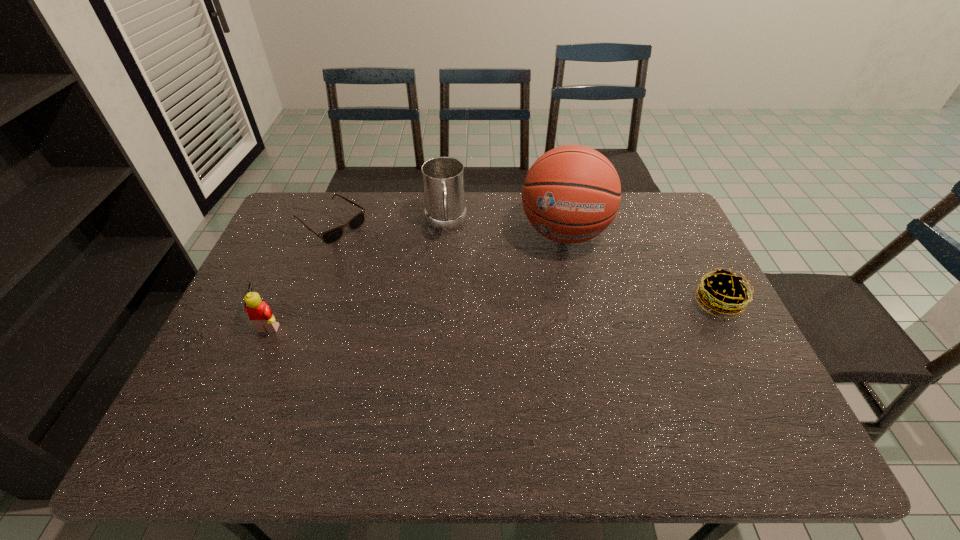
The height and width of the screenshot is (540, 960). I want to click on vacant area located 0.400m on the back of the patty, so click(667, 204).

Where is `vacant space situated on the logo side of the fourth object from left to right`? Image resolution: width=960 pixels, height=540 pixels. vacant space situated on the logo side of the fourth object from left to right is located at coordinates (x=553, y=343).

Find the location of `vacant region located on the logo side of the fourth object from left to right`. vacant region located on the logo side of the fourth object from left to right is located at coordinates (560, 281).

Where is `vacant area situated on the logo side of the fourth object from left to right`? vacant area situated on the logo side of the fourth object from left to right is located at coordinates (555, 330).

This screenshot has height=540, width=960. I want to click on vacant space located 0.110m on the side of the fourth shortest object with the handle, so click(446, 267).

At what (x,y) coordinates should I click in order to perform the action: click on free region located 0.120m on the side of the fourth shortest object with the handle. Please return your answer as a coordinate pair (x, y). Looking at the image, I should click on (447, 269).

Find the location of `blank space located on the side of the fourth shortest object with the handle`. blank space located on the side of the fourth shortest object with the handle is located at coordinates (450, 340).

Identify the location of blank area located 0.390m on the lenses of the shortest object. This screenshot has width=960, height=540. (441, 300).

This screenshot has height=540, width=960. I want to click on free location located on the lenses of the shortest object, so click(x=401, y=273).

The image size is (960, 540). In order to click on blank space located on the lenses of the shortest object in this screenshot , I will do `click(411, 280)`.